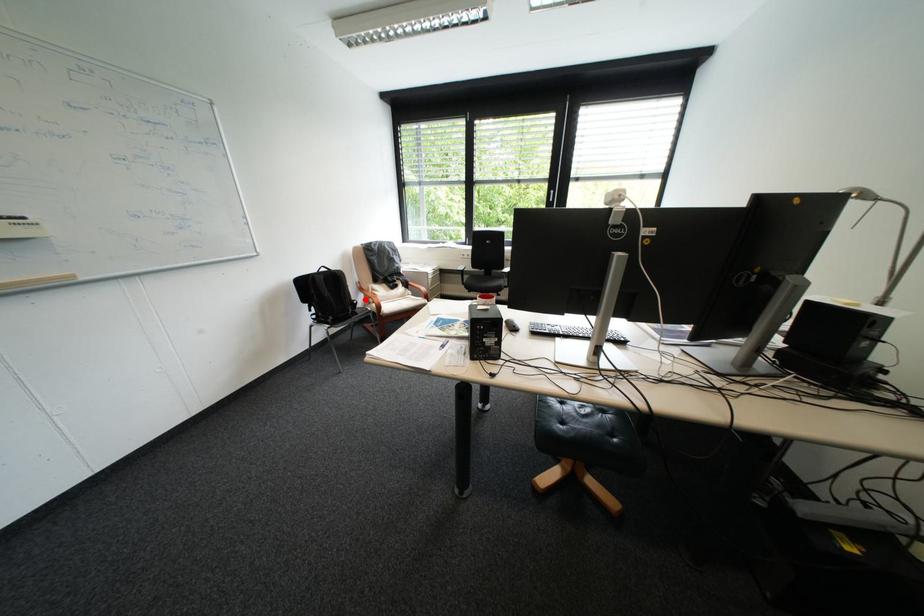
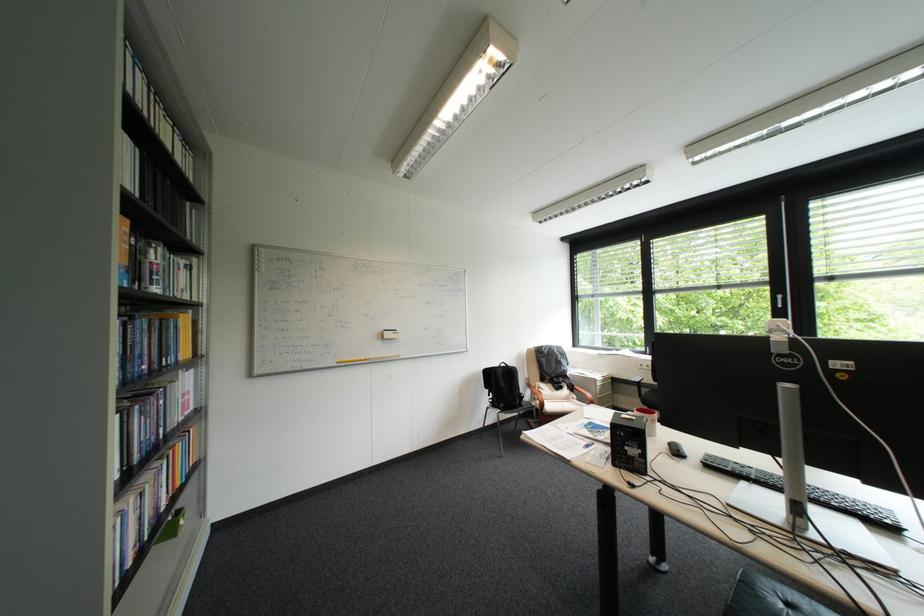
Where in the second image is the point corresponding to the highlighted location from the first image?

(533, 392)